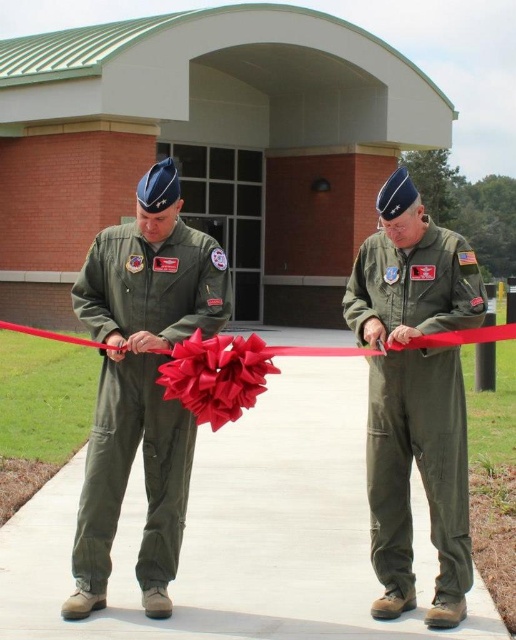
Question: Considering the relative positions of green matte uniform at center and green fabric uniform at center in the image provided, where is green matte uniform at center located with respect to green fabric uniform at center?

Choices:
 (A) above
 (B) below

Answer: (A)

Question: Which object is the farthest from the green fabric uniform at center?

Choices:
 (A) red satin ribbon at center
 (B) green matte uniform at center

Answer: (A)

Question: Which object is the closest to the green matte uniform at center?

Choices:
 (A) green fabric uniform at center
 (B) red satin ribbon at center

Answer: (A)

Question: Which object appears closest to the camera in this image?

Choices:
 (A) green matte uniform at center
 (B) green fabric uniform at center

Answer: (B)

Question: Is green matte uniform at center closer to the viewer compared to green fabric uniform at center?

Choices:
 (A) no
 (B) yes

Answer: (A)

Question: Is green fabric uniform at center wider than red satin ribbon at center?

Choices:
 (A) no
 (B) yes

Answer: (A)